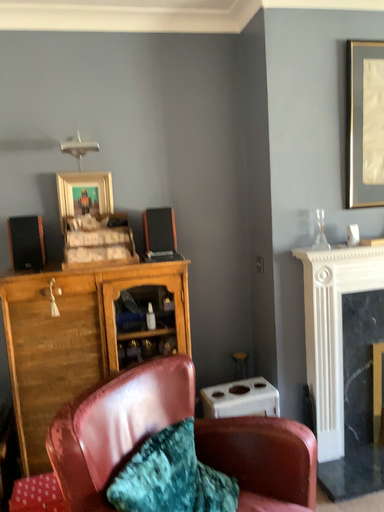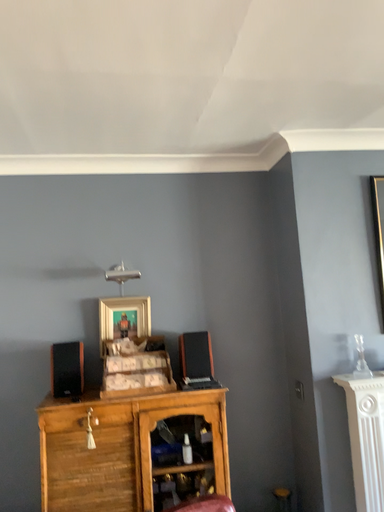
Question: How did the camera likely rotate when shooting the video?

Choices:
 (A) rotated downward
 (B) rotated upward

Answer: (B)